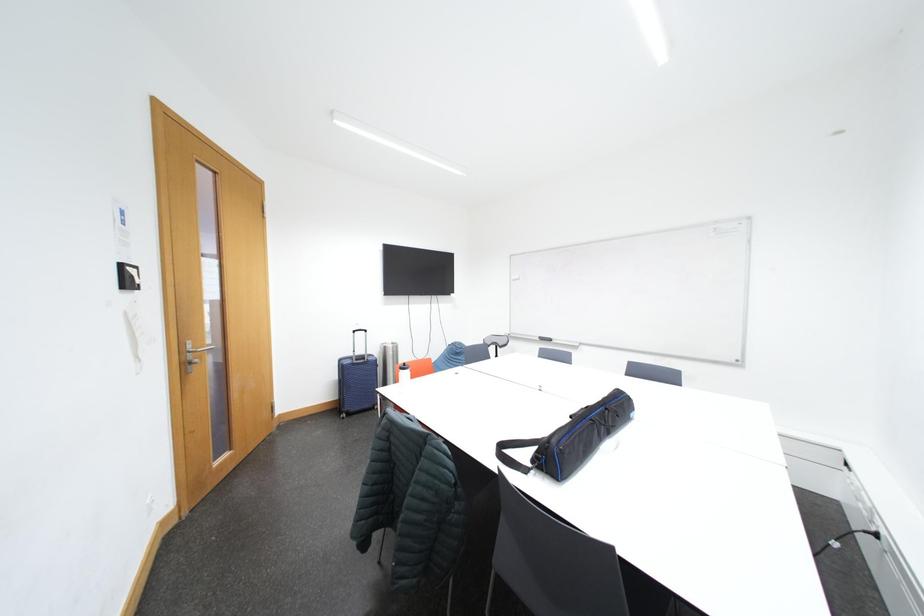
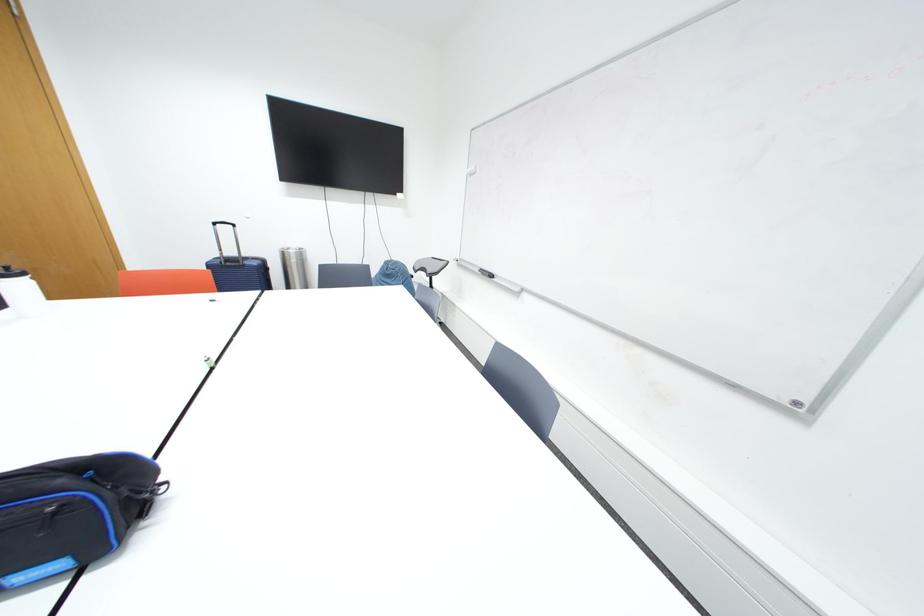
What movement of the cameraman would produce the second image?

The movement direction of the cameraman is right, forward.